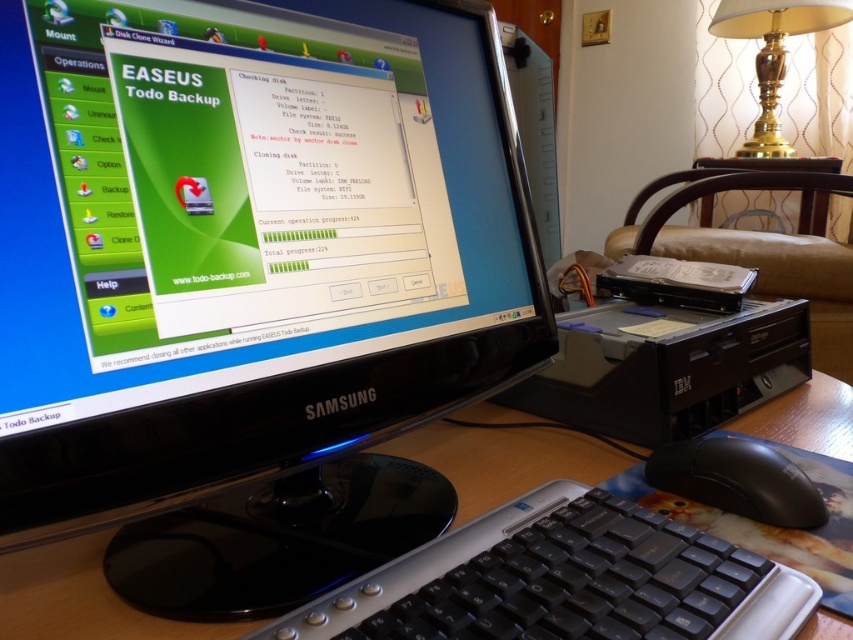
Question: Does wooden at center have a smaller size compared to black matte mouse at lower right?

Choices:
 (A) yes
 (B) no

Answer: (B)

Question: Does black plastic keyboard at center come behind gold brass lamp at upper right?

Choices:
 (A) yes
 (B) no

Answer: (B)

Question: Estimate the real-world distances between objects in this image. Which object is closer to the black plastic keyboard at center?

Choices:
 (A) black plastic monitor at center
 (B) gold brass lamp at upper right
 (C) black matte mouse at lower right

Answer: (C)

Question: Which is nearer to the black matte mouse at lower right?

Choices:
 (A) wooden at center
 (B) black plastic monitor at center

Answer: (A)

Question: Which point is farther from the camera taking this photo?

Choices:
 (A) (585, 516)
 (B) (746, 13)

Answer: (B)

Question: Does black plastic keyboard at center have a larger size compared to black matte mouse at lower right?

Choices:
 (A) no
 (B) yes

Answer: (B)